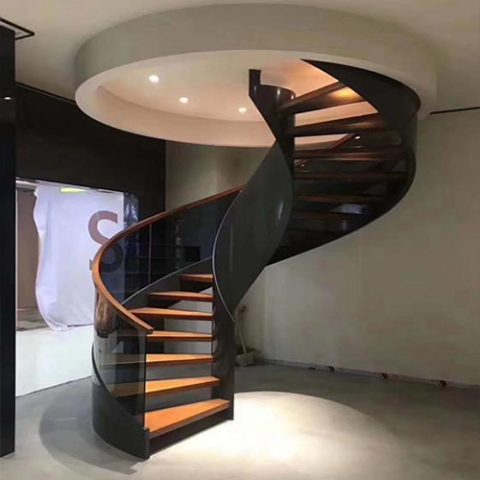
You are a GUI agent. You are given a task and a screenshot of the screen. Output one action in this format:
    pyautogui.click(x=<x>, y=<y>)
    Task: Click on the wooden handrail
    This screenshot has height=480, width=480.
    Given the screenshot: What is the action you would take?
    click(x=119, y=308), click(x=339, y=140), click(x=298, y=160)